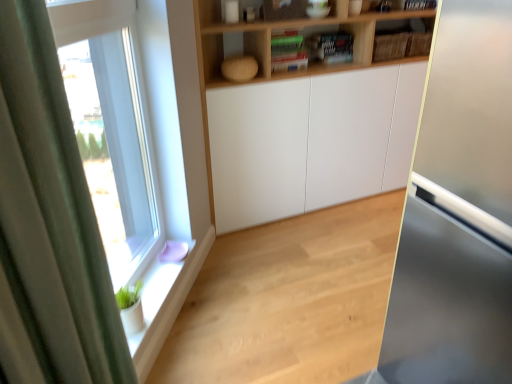
The height and width of the screenshot is (384, 512). What do you see at coordinates (165, 302) in the screenshot?
I see `white glossy window sill at lower left` at bounding box center [165, 302].

You are a GUI agent. You are given a task and a screenshot of the screen. Output one action in this format:
    pyautogui.click(x=<x>, y=<y>)
    Task: Click on the wooden shelf at upper center
    The height and width of the screenshot is (384, 512).
    Given the screenshot: What is the action you would take?
    pyautogui.click(x=270, y=41)

The width and height of the screenshot is (512, 384). What do you see at coordinates (289, 300) in the screenshot?
I see `natural wood floor at lower left` at bounding box center [289, 300].

In order to face clear glass window at left, should I rotate leftwards or rightwards?

It's best to rotate left around 17.061 degrees.

The width and height of the screenshot is (512, 384). I want to click on green fabric curtain at left, so click(51, 214).

Relative to clear glass window at left, is natural wood floor at lower left in front or behind?

Visually, natural wood floor at lower left is located behind clear glass window at left.

Can you confirm if natural wood floor at lower left is wider than clear glass window at left?

Yes.

Does natural wood floor at lower left turn towards clear glass window at left?

No, natural wood floor at lower left is not oriented towards clear glass window at left.

Which of these two, natural wood floor at lower left or clear glass window at left, is smaller?

clear glass window at left.

At what (x,y) coordinates should I click in order to perform the action: click on hardwood on the right of clear glass window at left. Please return your answer as a coordinate pair (x, y). Looking at the image, I should click on tap(289, 300).

From the image's perspective, which is above, clear glass window at left or natural wood floor at lower left?

clear glass window at left, from the image's perspective.

From a real-world perspective, between clear glass window at left and natural wood floor at lower left, who is vertically higher?

clear glass window at left, from a real-world perspective.

In terms of size, does clear glass window at left appear bigger or smaller than natural wood floor at lower left?

clear glass window at left is smaller than natural wood floor at lower left.

Can we say natural wood floor at lower left lies outside green fabric curtain at left?

Yes, natural wood floor at lower left is not within green fabric curtain at left.

Considering the relative sizes of natural wood floor at lower left and green fabric curtain at left in the image provided, is natural wood floor at lower left bigger than green fabric curtain at left?

Yes, natural wood floor at lower left is bigger than green fabric curtain at left.

How different are the orientations of natural wood floor at lower left and green fabric curtain at left in degrees?

They differ by 128 degrees in their facing directions.

Identify the location of curtain that is on the left side of natural wood floor at lower left. (51, 214).

Considering the relative sizes of wooden shelf at upper center and natural wood floor at lower left in the image provided, is wooden shelf at upper center wider than natural wood floor at lower left?

In fact, wooden shelf at upper center might be narrower than natural wood floor at lower left.

Can you tell me how much wooden shelf at upper center and natural wood floor at lower left differ in facing direction?

The angle between the facing direction of wooden shelf at upper center and the facing direction of natural wood floor at lower left is 179 degrees.

Considering the positions of points (405, 11) and (317, 296), is point (405, 11) closer to camera compared to point (317, 296)?

No, it is behind (317, 296).

Who is more distant, wooden shelf at upper center or natural wood floor at lower left?

Positioned behind is wooden shelf at upper center.

Is natural wood floor at lower left wider than wooden shelf at upper center?

Yes.

This screenshot has height=384, width=512. In the image, there is a wooden shelf at upper center. Identify the location of hardwood below it (from a real-world perspective). (289, 300).

From a real-world perspective, is natural wood floor at lower left on wooden shelf at upper center?

Actually, natural wood floor at lower left is physically below wooden shelf at upper center in the real world.

Is natural wood floor at lower left situated inside wooden shelf at upper center or outside?

natural wood floor at lower left is spatially situated outside wooden shelf at upper center.

From the image's perspective, is clear glass window at left under green fabric curtain at left?

Actually, clear glass window at left appears above green fabric curtain at left in the image.

Does clear glass window at left appear on the left side of green fabric curtain at left?

Correct, you'll find clear glass window at left to the left of green fabric curtain at left.

In the scene shown: Is clear glass window at left looking in the opposite direction of green fabric curtain at left?

clear glass window at left is not turned away from green fabric curtain at left.

Can you confirm if clear glass window at left is wider than green fabric curtain at left?

Incorrect, the width of clear glass window at left does not surpass that of green fabric curtain at left.

This screenshot has height=384, width=512. Identify the location of window sill above the natural wood floor at lower left (from a real-world perspective). (165, 302).

How many degrees apart are the facing directions of natural wood floor at lower left and white glossy window sill at lower left?

The facing directions of natural wood floor at lower left and white glossy window sill at lower left are 126 degrees apart.

Does natural wood floor at lower left have a smaller size compared to white glossy window sill at lower left?

Actually, natural wood floor at lower left might be larger than white glossy window sill at lower left.

Is white glossy window sill at lower left surrounded by natural wood floor at lower left?

Actually, white glossy window sill at lower left is outside natural wood floor at lower left.

Image resolution: width=512 pixels, height=384 pixels. I want to click on hardwood located underneath the clear glass window at left (from a real-world perspective), so click(x=289, y=300).

Image resolution: width=512 pixels, height=384 pixels. What are the coordinates of `hardwood that appears on the right of clear glass window at left` in the screenshot? It's located at (289, 300).

Estimate the real-world distances between objects in this image. Which object is further from natural wood floor at lower left, wooden shelf at upper center or green fabric curtain at left?

Based on the image, green fabric curtain at left appears to be further to natural wood floor at lower left.

Considering their positions, is wooden shelf at upper center positioned closer to clear glass window at left than green fabric curtain at left?

green fabric curtain at left is closer to clear glass window at left.

When comparing their distances from wooden shelf at upper center, does white glossy window sill at lower left or natural wood floor at lower left seem closer?

natural wood floor at lower left.

Which object lies nearer to the anchor point natural wood floor at lower left, white glossy window sill at lower left or wooden shelf at upper center?

Among the two, white glossy window sill at lower left is located nearer to natural wood floor at lower left.

Considering their positions, is green fabric curtain at left positioned closer to white glossy window sill at lower left than clear glass window at left?

Among the two, clear glass window at left is located nearer to white glossy window sill at lower left.

Which object lies nearer to the anchor point wooden shelf at upper center, green fabric curtain at left or clear glass window at left?

Among the two, clear glass window at left is located nearer to wooden shelf at upper center.

Looking at the image, which one is located further to clear glass window at left, wooden shelf at upper center or natural wood floor at lower left?

The object further to clear glass window at left is wooden shelf at upper center.

Considering their positions, is wooden shelf at upper center positioned closer to green fabric curtain at left than white glossy window sill at lower left?

Among the two, white glossy window sill at lower left is located nearer to green fabric curtain at left.

Where is `curtain located between clear glass window at left and natural wood floor at lower left in the left-right direction`? curtain located between clear glass window at left and natural wood floor at lower left in the left-right direction is located at coordinates (51, 214).

Locate an element on the screen. The image size is (512, 384). window between wooden shelf at upper center and white glossy window sill at lower left from top to bottom is located at coordinates (137, 134).

Where is `window between wooden shelf at upper center and natural wood floor at lower left in the vertical direction`? This screenshot has width=512, height=384. window between wooden shelf at upper center and natural wood floor at lower left in the vertical direction is located at coordinates (137, 134).

Identify the location of hardwood that lies between wooden shelf at upper center and white glossy window sill at lower left from top to bottom. (289, 300).